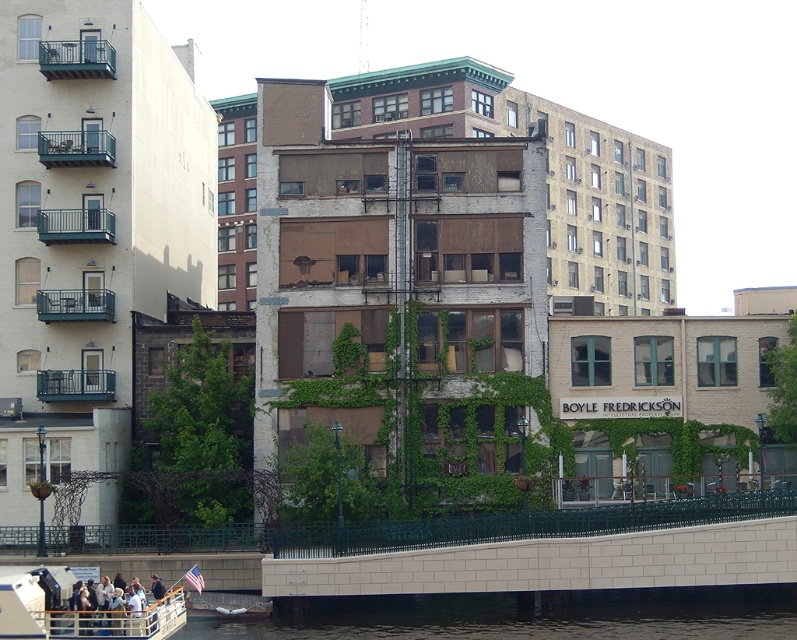
Question: Is black concrete water at lower center to the left of white plastic boat at lower left from the viewer's perspective?

Choices:
 (A) yes
 (B) no

Answer: (B)

Question: Which point is closer to the camera?

Choices:
 (A) (89, 632)
 (B) (505, 632)

Answer: (A)

Question: Among these objects, which one is farthest from the camera?

Choices:
 (A) white plastic boat at lower left
 (B) black concrete water at lower center

Answer: (B)

Question: Observing the image, what is the correct spatial positioning of black concrete water at lower center in reference to white plastic boat at lower left?

Choices:
 (A) below
 (B) above

Answer: (A)

Question: Is black concrete water at lower center above white plastic boat at lower left?

Choices:
 (A) no
 (B) yes

Answer: (A)